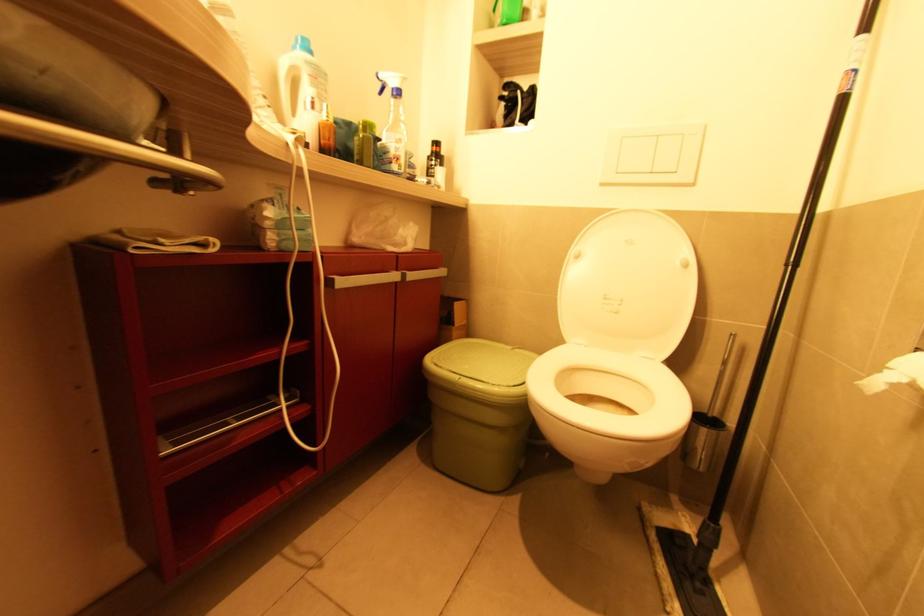
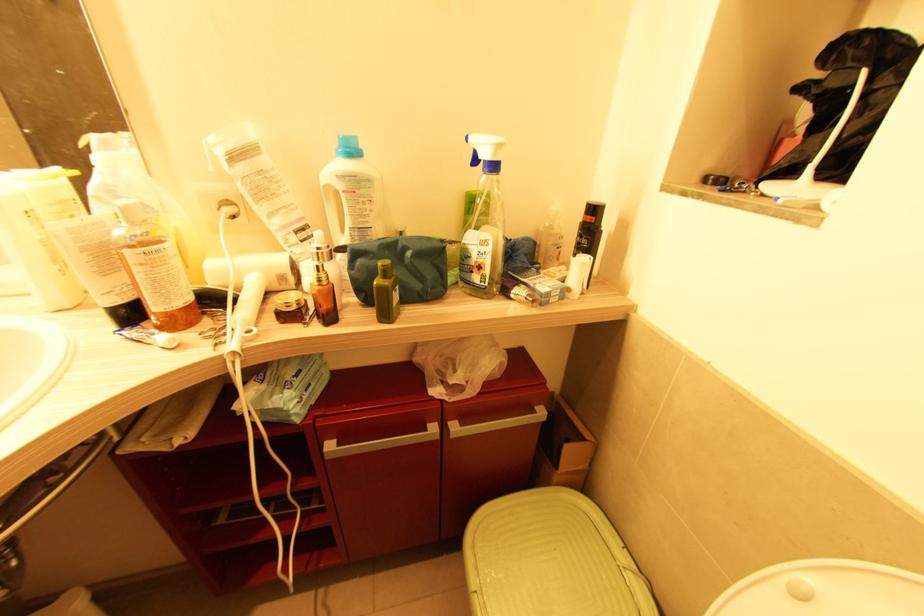
The point at (520, 92) is marked in the first image. Where is the corresponding point in the second image?

(867, 73)